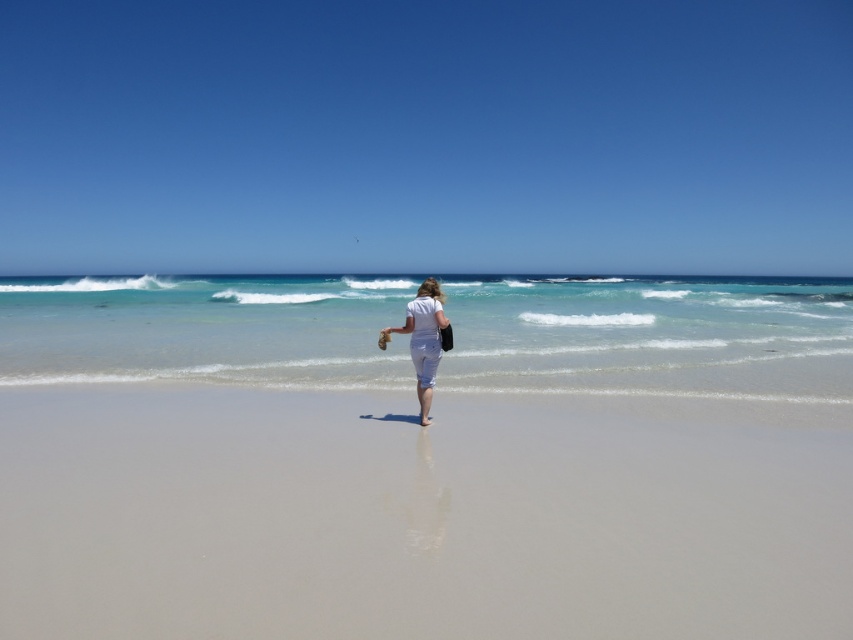
Between smooth sand at center and white cotton pants at center, which one has more height?

white cotton pants at center

Which of these two, smooth sand at center or white cotton pants at center, stands shorter?

Standing shorter between the two is smooth sand at center.

Find the location of a particular element. smooth sand at center is located at coordinates (428, 509).

Who is more forward, [804,508] or [494,360]?

Point [804,508] is more forward.

Measure the distance between smooth sand at center and camera.

smooth sand at center and camera are 3.66 meters apart.

Where is `smooth sand at center`? Image resolution: width=853 pixels, height=640 pixels. smooth sand at center is located at coordinates (428, 509).

Is clear blue water at center smaller than white cotton pants at center?

No.

Does clear blue water at center appear over white cotton pants at center?

Indeed, clear blue water at center is positioned over white cotton pants at center.

Identify the location of clear blue water at center. The height and width of the screenshot is (640, 853). (650, 333).